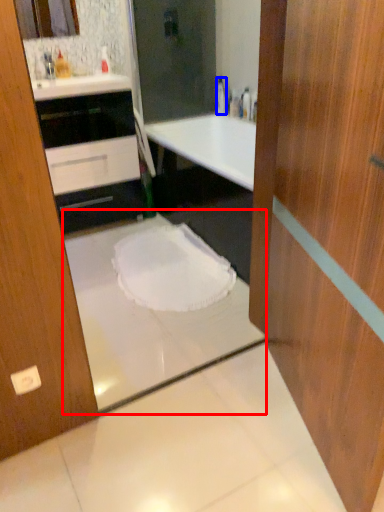
Question: Which object is further to the camera taking this photo, bath (highlighted by a red box) or bottle (highlighted by a blue box)?

Choices:
 (A) bath
 (B) bottle

Answer: (B)